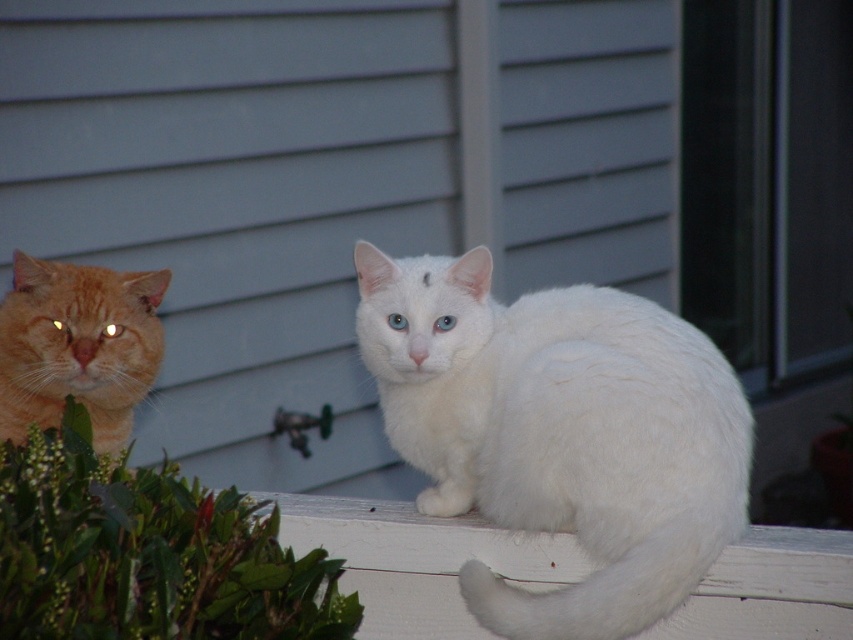
From the picture: Does white fluffy cat at center have a greater height compared to white painted wood at lower center?

Yes.

Can you confirm if white fluffy cat at center is bigger than white painted wood at lower center?

Yes, white fluffy cat at center is bigger than white painted wood at lower center.

The image size is (853, 640). I want to click on white fluffy cat at center, so click(x=560, y=433).

Is point (410, 561) less distant than point (86, 355)?

That is True.

This screenshot has height=640, width=853. What are the coordinates of `white painted wood at lower center` in the screenshot? It's located at (418, 561).

Does white fluffy cat at center lie behind orange fur cat at left?

No.

Which is behind, point (618, 340) or point (90, 305)?

The point (90, 305) is more distant.

The height and width of the screenshot is (640, 853). What do you see at coordinates (560, 433) in the screenshot?
I see `white fluffy cat at center` at bounding box center [560, 433].

At what (x,y) coordinates should I click in order to perform the action: click on white fluffy cat at center. Please return your answer as a coordinate pair (x, y). The image size is (853, 640). Looking at the image, I should click on (560, 433).